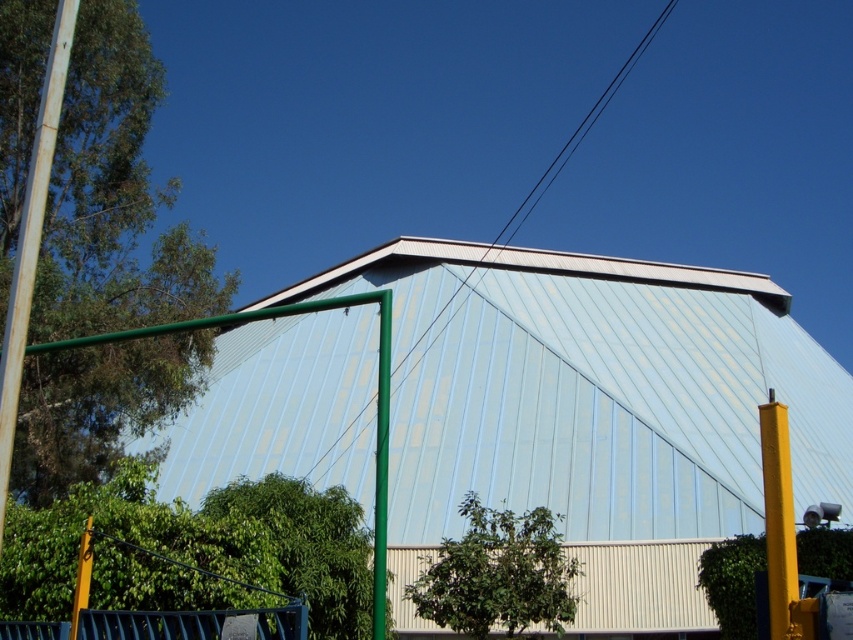
You are an architect inspecting the building. You notice the smooth wire at upper center and the green matte pole at center. Which object is higher in height?

The smooth wire at upper center is taller than the green matte pole at center.

You are standing at the entrance of the building and want to locate the green matte pole at center. According to the coordinates provided, in which direction should you look to find it?

The green matte pole at center is located at coordinates point (381, 461), which means it is positioned to the right and slightly above the center of the image. You should look towards the upper right direction from the entrance to find it.